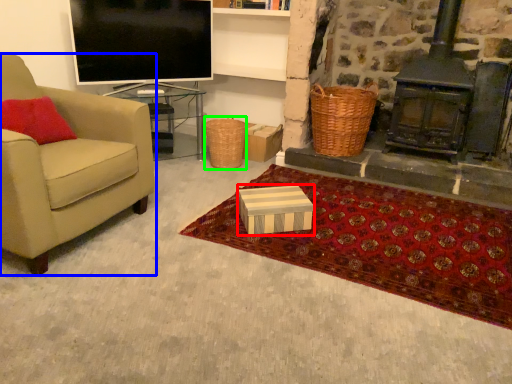
Question: Which is farther away from box (highlighted by a red box)? chair (highlighted by a blue box) or picnic basket (highlighted by a green box)?

Choices:
 (A) chair
 (B) picnic basket

Answer: (B)